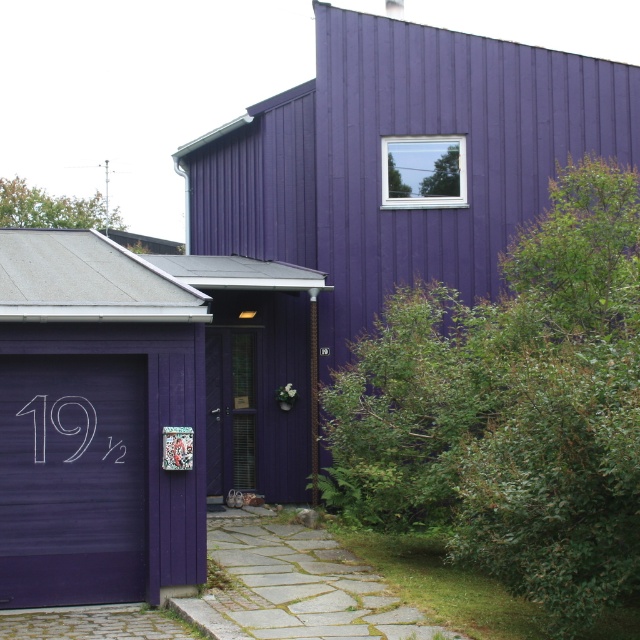
You are standing at the entrance of the purple residential building and want to locate two specific points marked on the image. The first point is at coordinates point (208, 365) and the second is at point (48, 412). Which of these points is closer to your current position?

Point (48, 412) is closer to your current position because it is in front of point (208, 365).

You are standing in front of the residential building and want to reach the entrance. The entrance is located at point (90, 522). If you walk straight ahead, will you reach the entrance before walking 15 meters?

The entrance at point (90, 522) is 12.09 meters away from the viewer. Since 12.09 meters is less than 15 meters, you will reach the entrance before walking 15 meters.